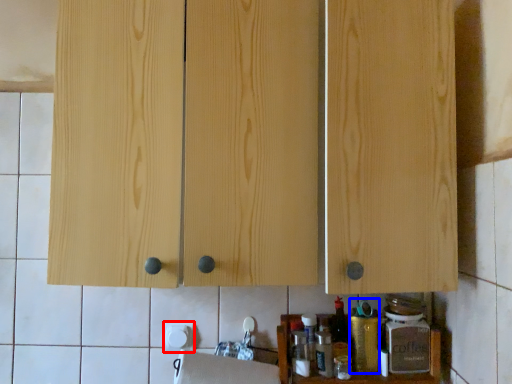
Question: Which of the following is the closest to the observer, paper towel (highlighted by a red box) or bottle (highlighted by a blue box)?

Choices:
 (A) paper towel
 (B) bottle

Answer: (B)